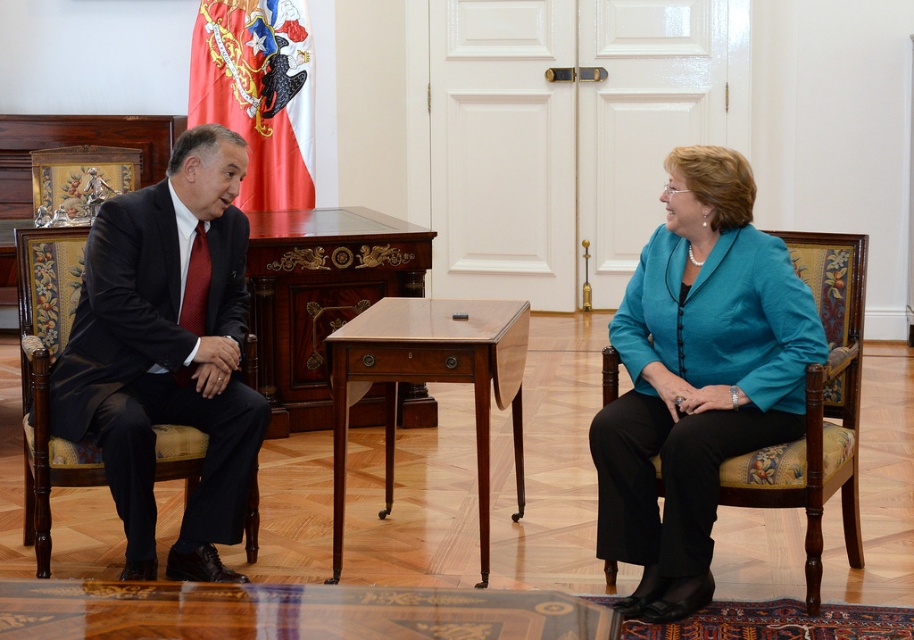
Between matte black suit at left and mahogany wood table at center, which one has more height?

matte black suit at left is taller.

Is point (129, 196) positioned behind point (434, 307)?

No.

What are the coordinates of `matte black suit at left` in the screenshot? It's located at (149, 378).

Which is in front, point (614, 541) or point (152, 444)?

Positioned in front is point (152, 444).

Find the location of a particular element. Image resolution: width=914 pixels, height=640 pixels. teal fabric jacket at center is located at coordinates (697, 376).

Is teal fabric jacket at center to the left of mahogany wood table at center from the viewer's perspective?

No, teal fabric jacket at center is not to the left of mahogany wood table at center.

Is teal fabric jacket at center positioned before mahogany wood table at center?

Yes, it is.

Between point (803, 316) and point (481, 372), which one is positioned in front?

Positioned in front is point (803, 316).

Where is `teal fabric jacket at center`? This screenshot has width=914, height=640. teal fabric jacket at center is located at coordinates (697, 376).